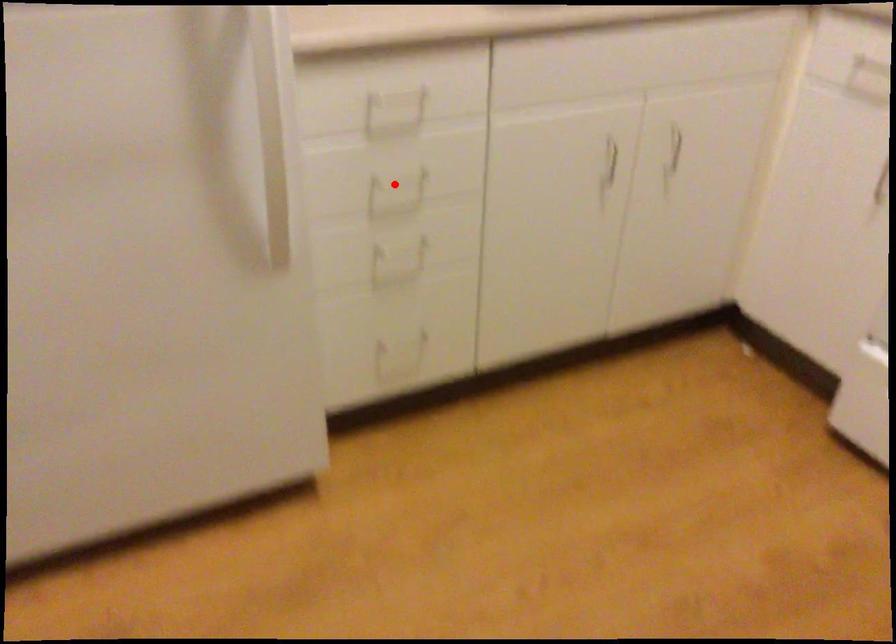
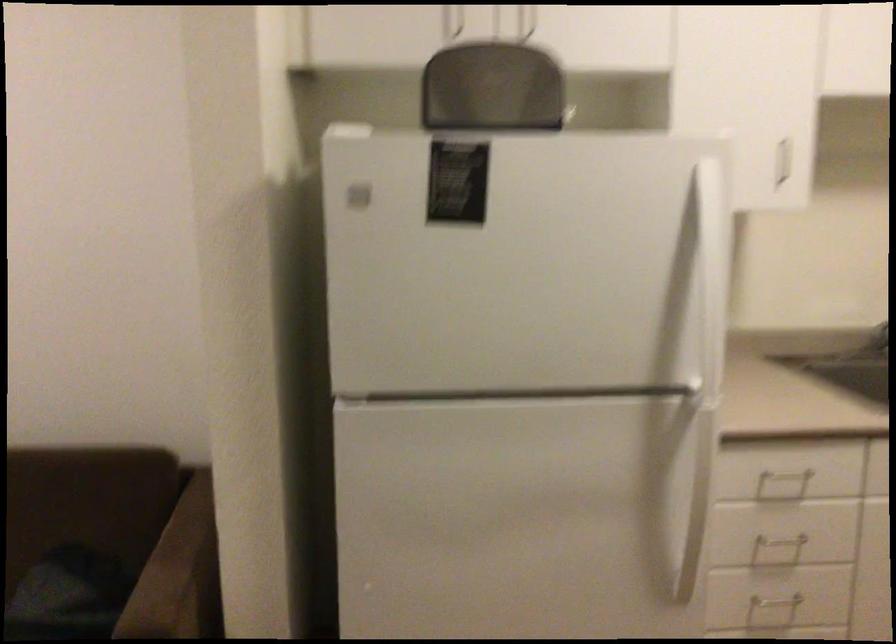
Question: A red point is marked in image1. In image2, is the corresponding 3D point closer to the camera or farther? Reply with the corresponding letter.

Choices:
 (A) The corresponding 3D point is closer.
 (B) The corresponding 3D point is farther.

Answer: (B)